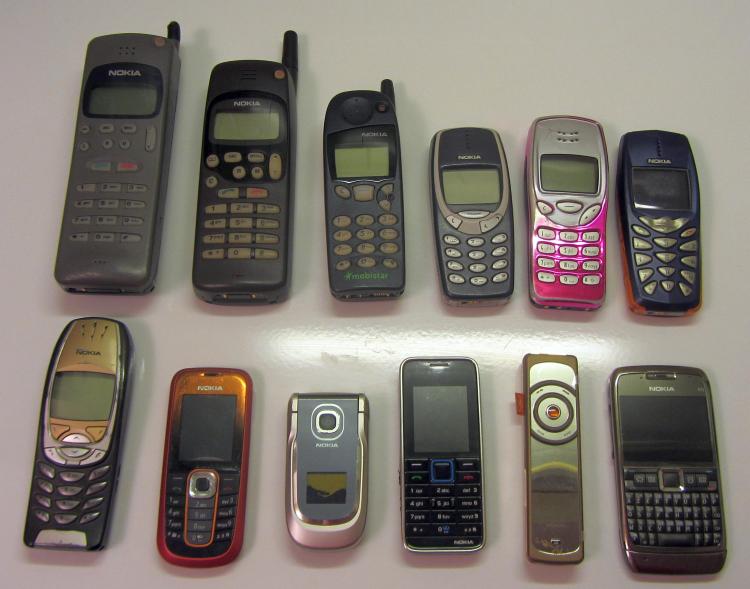
Locate an element on the screen. speaker is located at coordinates (656, 372), (442, 362), (212, 376), (93, 329), (132, 54), (252, 75), (354, 104), (470, 141), (567, 137), (660, 147).